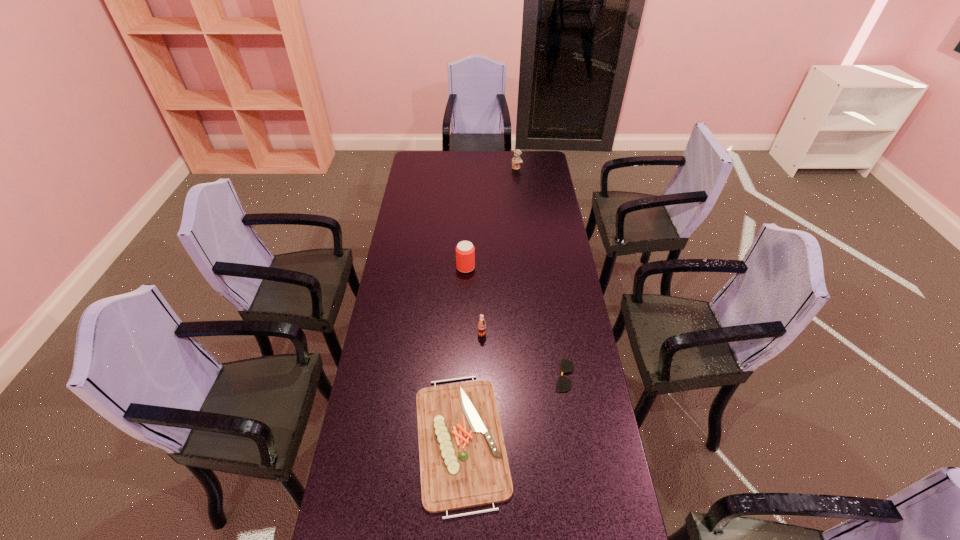
This screenshot has width=960, height=540. What are the coordinates of `beer can` in the screenshot? It's located at (465, 251).

Identify the location of the farthest object. The height and width of the screenshot is (540, 960). (516, 160).

Identify the location of the fourth object from left to right. Image resolution: width=960 pixels, height=540 pixels. (516, 160).

Locate an element on the screen. The width and height of the screenshot is (960, 540). the third farthest object is located at coordinates (481, 323).

The height and width of the screenshot is (540, 960). Find the location of `chopping board`. chopping board is located at coordinates (463, 462).

Identify the location of spectacles. (563, 384).

Where is `the shortest object`? Image resolution: width=960 pixels, height=540 pixels. the shortest object is located at coordinates point(563,384).

Where is `free region located on the left of the beer can`? The height and width of the screenshot is (540, 960). free region located on the left of the beer can is located at coordinates (410, 267).

This screenshot has width=960, height=540. I want to click on vacant space situated on the front-facing side of the teddy bear, so click(x=522, y=213).

I want to click on vacant area located 0.310m on the front of the third nearest object, so click(482, 415).